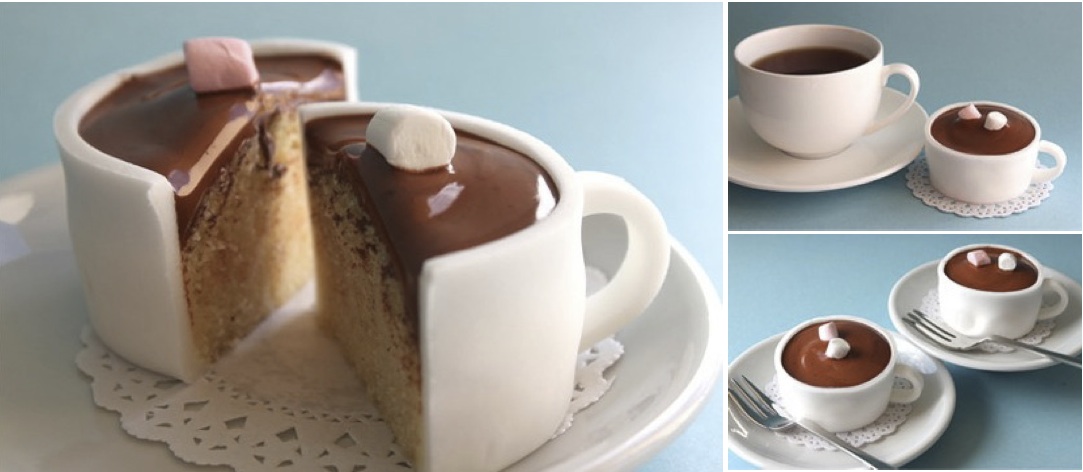
The image size is (1083, 472). What are the coordinates of `cup` in the screenshot? It's located at (815, 123).